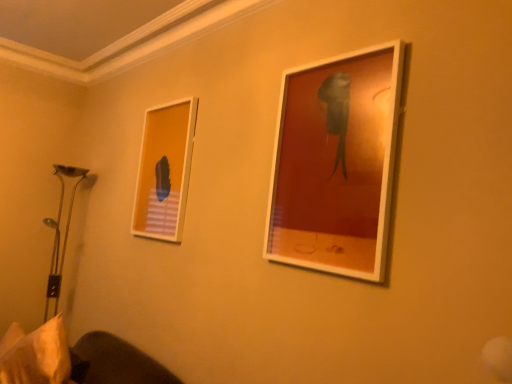
Question: From the image's perspective, is matte white picture frame at upper right, which appears as the second picture frame when viewed from the back, below matte white picture frame at upper left, the second picture frame in the right-to-left sequence?

Choices:
 (A) yes
 (B) no

Answer: (A)

Question: Considering the relative sizes of matte white picture frame at upper right, positioned as the second picture frame in left-to-right order, and matte white picture frame at upper left, the first picture frame when ordered from back to front, in the image provided, is matte white picture frame at upper right, positioned as the second picture frame in left-to-right order, bigger than matte white picture frame at upper left, the first picture frame when ordered from back to front,?

Choices:
 (A) yes
 (B) no

Answer: (A)

Question: Is matte white picture frame at upper right, positioned as the second picture frame in left-to-right order, not inside matte white picture frame at upper left, the 2th picture frame from the front?

Choices:
 (A) yes
 (B) no

Answer: (A)

Question: Is matte white picture frame at upper right, which appears as the second picture frame when viewed from the back, not close to matte white picture frame at upper left, marked as the first picture frame in a left-to-right arrangement?

Choices:
 (A) no
 (B) yes

Answer: (A)

Question: Is the depth of matte white picture frame at upper right, marked as the first picture frame in a right-to-left arrangement, less than that of matte white picture frame at upper left, the first picture frame when ordered from back to front?

Choices:
 (A) yes
 (B) no

Answer: (A)

Question: From their relative heights in the image, would you say white fabric pillow at lower left is taller or shorter than matte white picture frame at upper left, the second picture frame in the right-to-left sequence?

Choices:
 (A) short
 (B) tall

Answer: (A)

Question: Is white fabric pillow at lower left spatially inside matte white picture frame at upper left, the first picture frame when ordered from back to front, or outside of it?

Choices:
 (A) inside
 (B) outside

Answer: (B)

Question: In the image, is white fabric pillow at lower left on the left side or the right side of matte white picture frame at upper left, the first picture frame when ordered from back to front?

Choices:
 (A) left
 (B) right

Answer: (A)

Question: Considering the positions of point (51, 370) and point (144, 119), is point (51, 370) closer or farther from the camera than point (144, 119)?

Choices:
 (A) closer
 (B) farther

Answer: (A)

Question: From a real-world perspective, is matte white picture frame at upper left, the first picture frame when ordered from back to front, physically located above or below matte white picture frame at upper right, which appears as the second picture frame when viewed from the back?

Choices:
 (A) above
 (B) below

Answer: (B)

Question: In terms of height, does matte white picture frame at upper left, the 2th picture frame from the front, look taller or shorter compared to matte white picture frame at upper right, marked as the first picture frame in a front-to-back arrangement?

Choices:
 (A) short
 (B) tall

Answer: (A)

Question: Based on their sizes in the image, would you say matte white picture frame at upper left, the first picture frame when ordered from back to front, is bigger or smaller than matte white picture frame at upper right, marked as the first picture frame in a front-to-back arrangement?

Choices:
 (A) small
 (B) big

Answer: (A)

Question: In the image, is matte white picture frame at upper left, marked as the first picture frame in a left-to-right arrangement, positioned in front of or behind matte white picture frame at upper right, marked as the first picture frame in a front-to-back arrangement?

Choices:
 (A) front
 (B) behind

Answer: (B)

Question: Do you think white fabric pillow at lower left is within matte white picture frame at upper right, positioned as the second picture frame in left-to-right order, or outside of it?

Choices:
 (A) outside
 (B) inside

Answer: (A)

Question: Considering the positions of white fabric pillow at lower left and matte white picture frame at upper right, marked as the first picture frame in a front-to-back arrangement, in the image, is white fabric pillow at lower left taller or shorter than matte white picture frame at upper right, marked as the first picture frame in a front-to-back arrangement,?

Choices:
 (A) short
 (B) tall

Answer: (A)